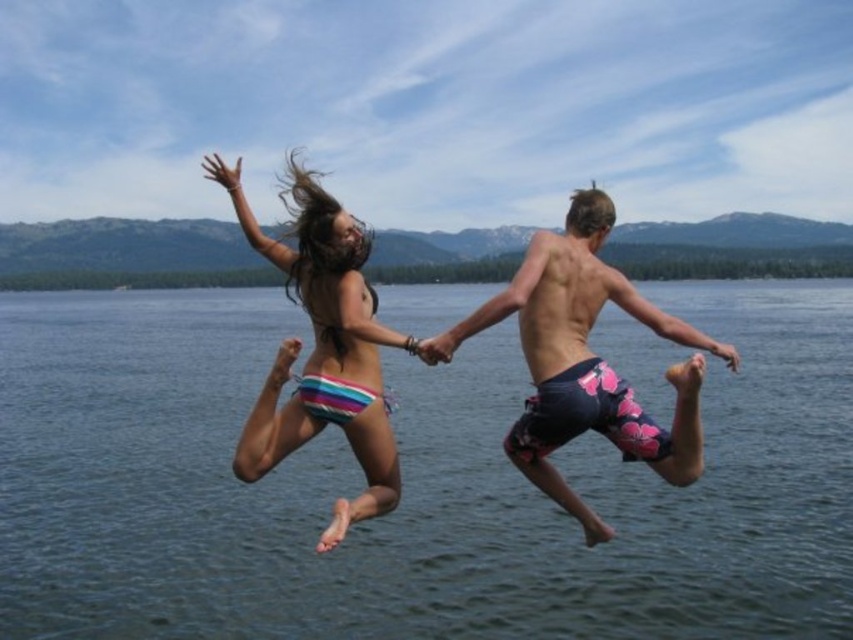
Between clear blue water at center and dark blue floral swim trunks at center, which one is positioned higher?

clear blue water at center is above.

Does clear blue water at center have a larger size compared to dark blue floral swim trunks at center?

Indeed, clear blue water at center has a larger size compared to dark blue floral swim trunks at center.

The width and height of the screenshot is (853, 640). What are the coordinates of `clear blue water at center` in the screenshot? It's located at (410, 483).

Is clear blue water at center further to camera compared to striped fabric bikini bottom at center?

Yes.

What do you see at coordinates (410, 483) in the screenshot? The width and height of the screenshot is (853, 640). I see `clear blue water at center` at bounding box center [410, 483].

Where is `clear blue water at center`? Image resolution: width=853 pixels, height=640 pixels. clear blue water at center is located at coordinates (410, 483).

Is dark blue floral swim trunks at center wider than striped fabric bikini bottom at center?

Indeed, dark blue floral swim trunks at center has a greater width compared to striped fabric bikini bottom at center.

Between dark blue floral swim trunks at center and striped fabric bikini bottom at center, which one is positioned lower?

striped fabric bikini bottom at center

Does point (540, 488) come in front of point (334, 310)?

Yes, it is.

This screenshot has width=853, height=640. Find the location of `dark blue floral swim trunks at center`. dark blue floral swim trunks at center is located at coordinates (585, 360).